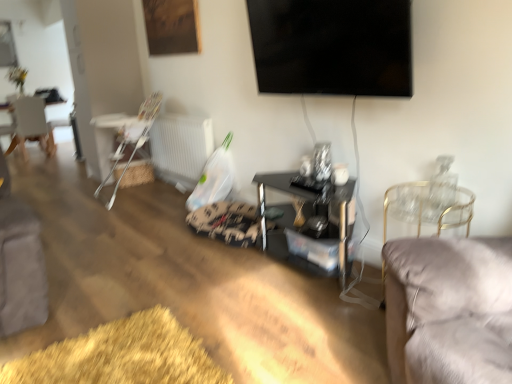
Question: In the image, is white wooden chair at left, the 3th chair in the front-to-back sequence, on the left side or the right side of velvet grey chair at right, which is counted as the third chair, starting from the back?

Choices:
 (A) left
 (B) right

Answer: (A)

Question: From a real-world perspective, is white wooden chair at left, the 1th chair viewed from the left, above or below velvet grey chair at right, marked as the 3th chair in a left-to-right arrangement?

Choices:
 (A) above
 (B) below

Answer: (A)

Question: Which of these objects is positioned closest to the velvet grey chair at right, which is counted as the third chair, starting from the back?

Choices:
 (A) black glossy tv at upper center
 (B) white plastic radiator at lower center
 (C) white wooden chair at left, which is counted as the 3th chair, starting from the right
 (D) white plastic highchair at left, which appears as the second chair when viewed from the right
 (E) metallic black coffee table at center

Answer: (E)

Question: Considering the real-world distances, which object is closest to the white plastic highchair at left, the 2th chair viewed from the front?

Choices:
 (A) velvet grey chair at right, which ranks as the first chair in right-to-left order
 (B) black glossy tv at upper center
 (C) white wooden chair at left, which is counted as the 3th chair, starting from the right
 (D) metallic black coffee table at center
 (E) white plastic radiator at lower center

Answer: (E)